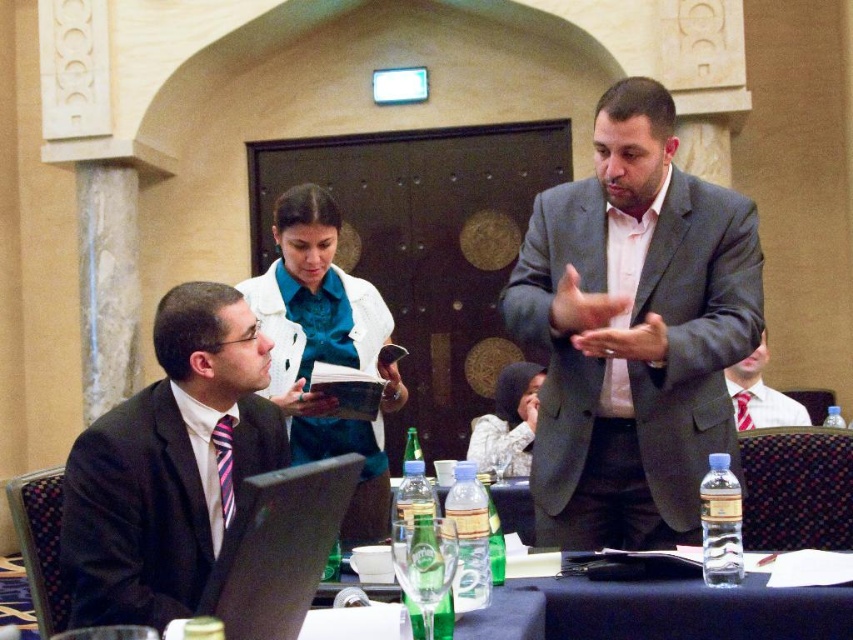
Question: Does teal fabric book at center lie behind matte gray suit at center?

Choices:
 (A) no
 (B) yes

Answer: (A)

Question: Among these objects, which one is farthest from the camera?

Choices:
 (A) clear plastic water at center
 (B) teal fabric book at center
 (C) matte black suit at left
 (D) white textured hijab at center

Answer: (D)

Question: Does gray suit at upper right appear under white textured hijab at center?

Choices:
 (A) no
 (B) yes

Answer: (A)

Question: Which point is farther from the camera taking this photo?

Choices:
 (A) (146, 490)
 (B) (544, 625)
 (C) (769, 404)
 (D) (531, 413)

Answer: (D)

Question: Among these objects, which one is farthest from the camera?

Choices:
 (A) matte gray suit at center
 (B) teal fabric book at center
 (C) matte black suit at left
 (D) clear plastic water at center

Answer: (A)

Question: Is clear plastic water at center to the right of white textured hijab at center from the viewer's perspective?

Choices:
 (A) no
 (B) yes

Answer: (B)